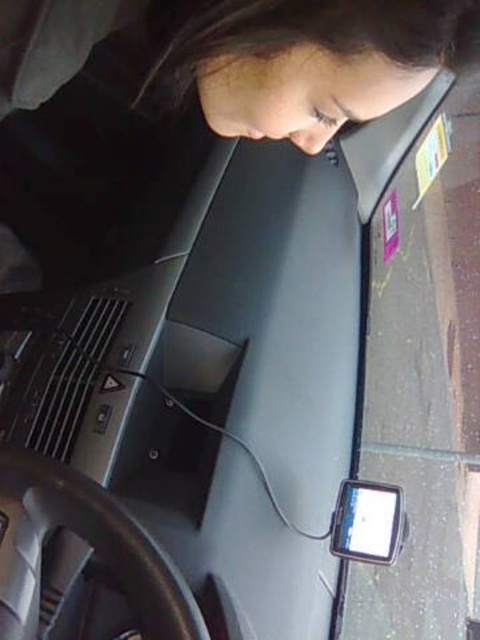
Who is positioned more to the left, matte black laptop at center or matte black smartphone at lower right?

matte black laptop at center

Does matte black laptop at center come in front of matte black smartphone at lower right?

Yes, matte black laptop at center is closer to the viewer.

What do you see at coordinates (205, 108) in the screenshot?
I see `matte black laptop at center` at bounding box center [205, 108].

You are a GUI agent. You are given a task and a screenshot of the screen. Output one action in this format:
    pyautogui.click(x=<x>, y=<y>)
    Task: Click on the matte black laptop at center
    This screenshot has width=480, height=640.
    Given the screenshot: What is the action you would take?
    pyautogui.click(x=205, y=108)